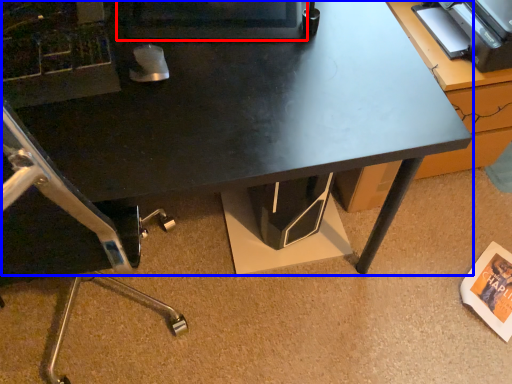
Question: Which object is closer to the camera taking this photo, computer monitor (highlighted by a red box) or desk (highlighted by a blue box)?

Choices:
 (A) computer monitor
 (B) desk

Answer: (B)